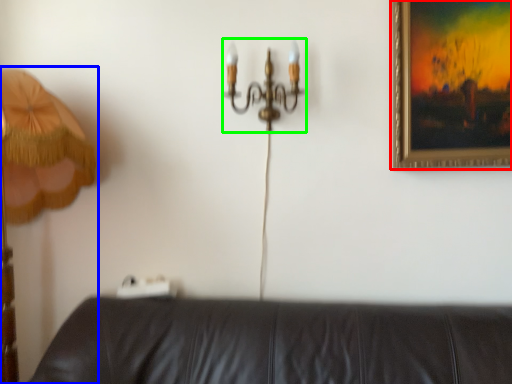
Question: Which object is positioned farthest from picture frame (highlighted by a red box)? Select from lamp (highlighted by a blue box) and chandelier (highlighted by a green box).

Choices:
 (A) lamp
 (B) chandelier

Answer: (A)